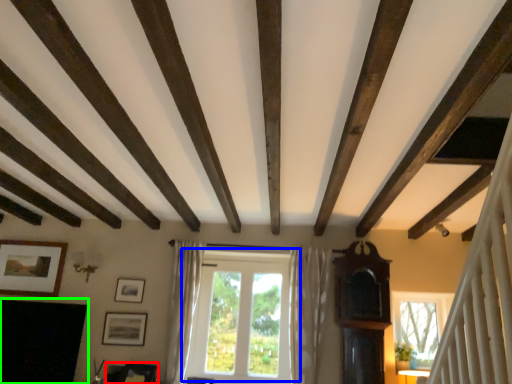
Question: Which object is the farthest from furniture (highlighted by a red box)? Choose among these: window (highlighted by a blue box) or fireplace (highlighted by a green box).

Choices:
 (A) window
 (B) fireplace

Answer: (A)